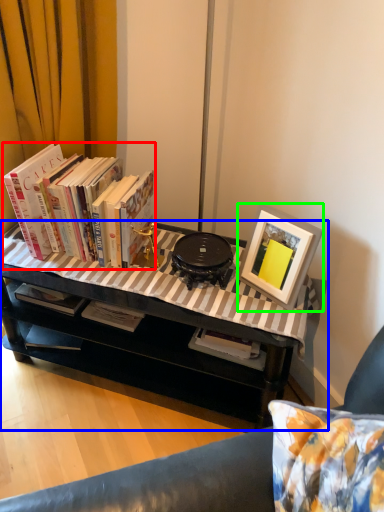
Question: Considering the real-world distances, which object is farthest from book (highlighted by a red box)? table (highlighted by a blue box) or picture frame (highlighted by a green box)?

Choices:
 (A) table
 (B) picture frame

Answer: (B)